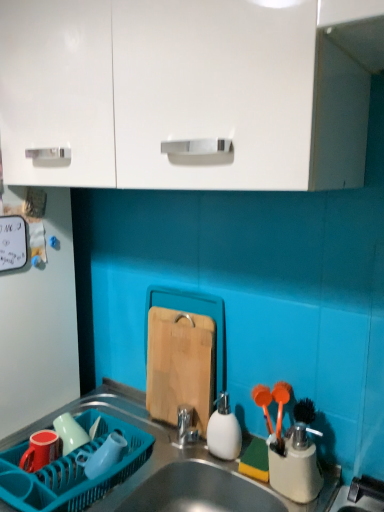
This screenshot has width=384, height=512. In order to click on free space that is to the left of wooden cutting board at center in this screenshot , I will do `click(130, 424)`.